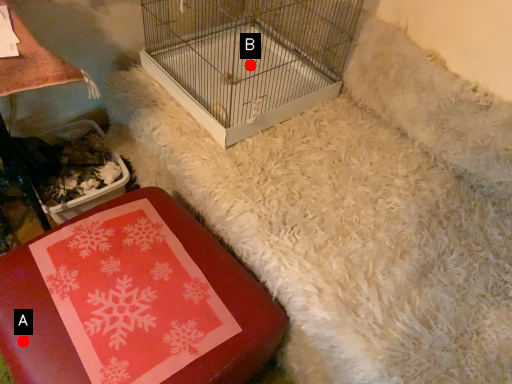
Question: Two points are circled on the image, labeled by A and B beside each circle. Which point is further to the camera?

Choices:
 (A) A is further
 (B) B is further

Answer: (B)